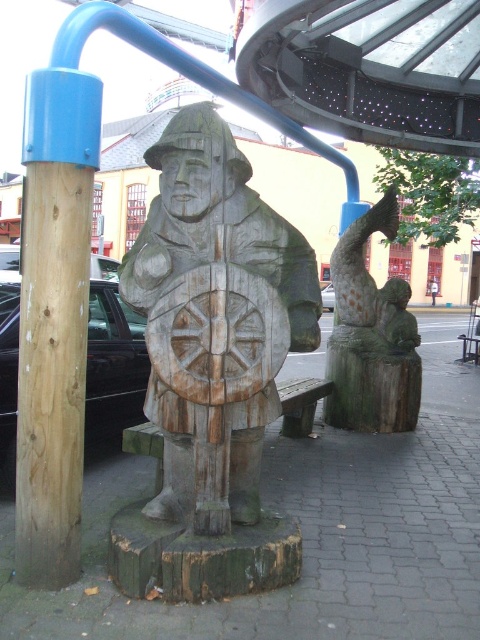
Question: Considering the relative positions of wooden shield at center and wooden statue at right in the image provided, where is wooden shield at center located with respect to wooden statue at right?

Choices:
 (A) right
 (B) left

Answer: (B)

Question: Which object is farther from the camera taking this photo?

Choices:
 (A) wooden statue at right
 (B) natural wood post at left
 (C) wooden shield at center

Answer: (A)

Question: Considering the relative positions of natural wood post at left and wooden statue at right in the image provided, where is natural wood post at left located with respect to wooden statue at right?

Choices:
 (A) right
 (B) left

Answer: (B)

Question: Which is farther from the wooden shield at center?

Choices:
 (A) wooden statue at right
 (B) natural wood post at left

Answer: (A)

Question: Can you confirm if natural wood post at left is smaller than wooden statue at right?

Choices:
 (A) no
 (B) yes

Answer: (B)

Question: Which object is the closest to the natural wood post at left?

Choices:
 (A) wooden statue at right
 (B) wooden shield at center

Answer: (B)